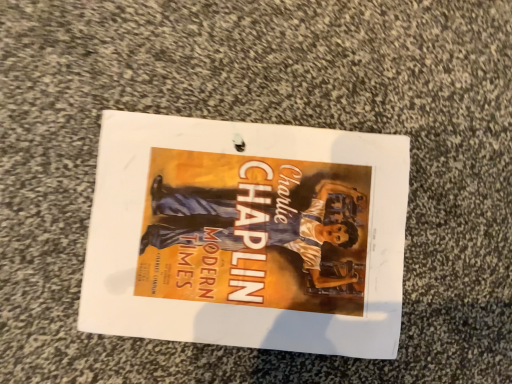
The width and height of the screenshot is (512, 384). I want to click on blank space situated above matte paper poster at center (from a real-world perspective), so click(x=239, y=241).